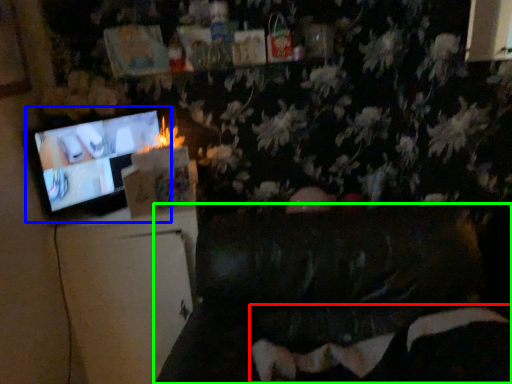
Question: Estimate the real-world distances between objects in this image. Which object is farther from bean bag chair (highlighted by a red box), television (highlighted by a blue box) or furniture (highlighted by a green box)?

Choices:
 (A) television
 (B) furniture

Answer: (A)